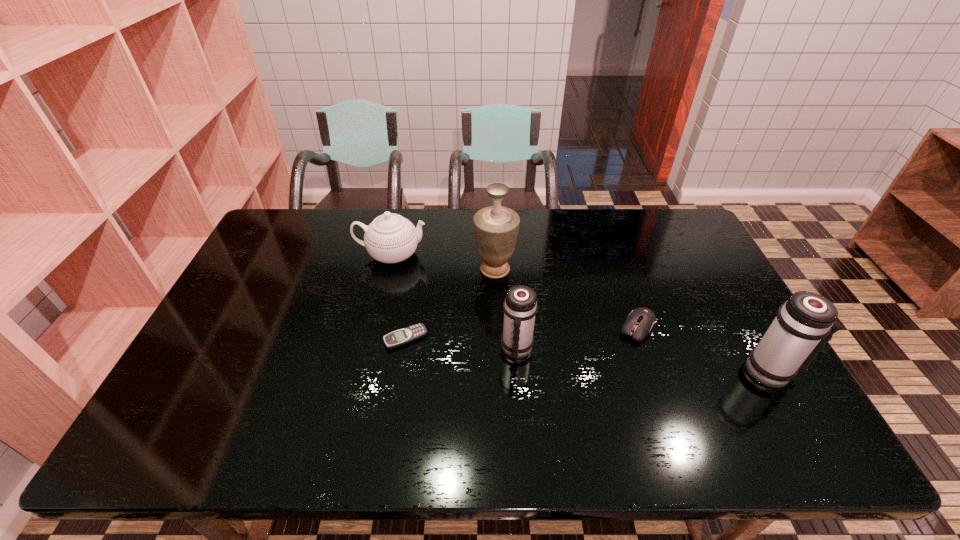
At what (x,y) coordinates should I click in order to perform the action: click on the third closest object to the urn. Please return your answer as a coordinate pair (x, y). This screenshot has height=540, width=960. Looking at the image, I should click on (406, 335).

This screenshot has width=960, height=540. Find the location of `free region that satisfies the following two spatial constraints: 1. on the back side of the second object from right to left; 2. on the spout of the chinaware`. free region that satisfies the following two spatial constraints: 1. on the back side of the second object from right to left; 2. on the spout of the chinaware is located at coordinates (612, 255).

The width and height of the screenshot is (960, 540). What are the coordinates of `free space that satisfies the following two spatial constraints: 1. on the spout of the fourth tallest object; 2. on the left side of the urn` in the screenshot? It's located at (389, 269).

Locate an element on the screen. This screenshot has width=960, height=540. blank space that satisfies the following two spatial constraints: 1. on the spout of the fourth tallest object; 2. on the left side of the urn is located at coordinates (389, 269).

The image size is (960, 540). In order to click on vacant point that satisfies the following two spatial constraints: 1. on the spout of the third shortest object; 2. on the back side of the urn in this screenshot , I will do `click(389, 269)`.

This screenshot has width=960, height=540. I want to click on free location that satisfies the following two spatial constraints: 1. on the spout of the tallest object; 2. on the left side of the chinaware, so click(x=389, y=269).